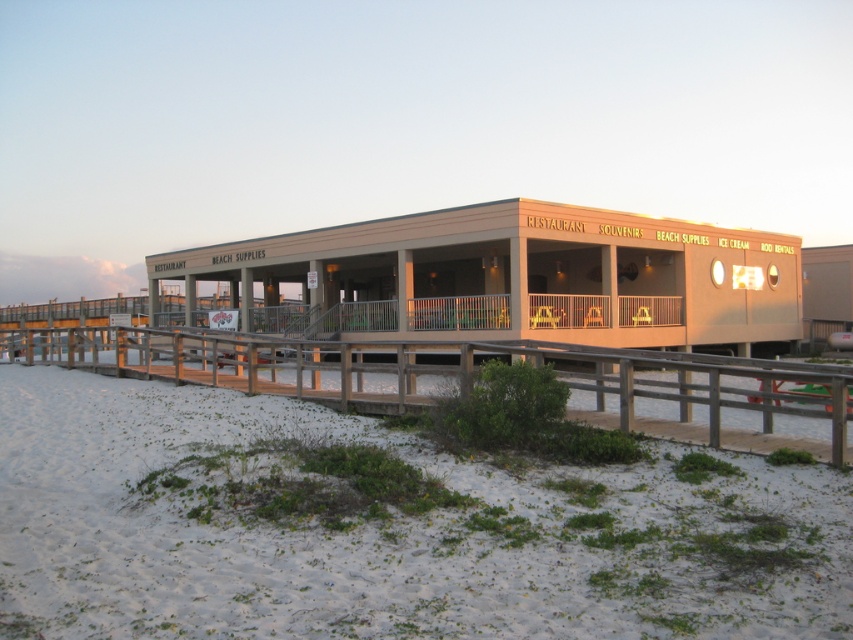
Can you confirm if white sandy beach at lower left is positioned to the left of beige wooden dock at center?

Correct, you'll find white sandy beach at lower left to the left of beige wooden dock at center.

Based on the photo, does white sandy beach at lower left have a larger size compared to beige wooden dock at center?

No.

Does point (453, 550) come farther from viewer compared to point (347, 236)?

No, it is not.

Locate an element on the screen. The height and width of the screenshot is (640, 853). white sandy beach at lower left is located at coordinates (383, 529).

Who is shorter, white sandy beach at lower left or wooden at lower left?

white sandy beach at lower left

Between white sandy beach at lower left and wooden at lower left, which one is positioned lower?

white sandy beach at lower left is below.

Locate an element on the screen. The height and width of the screenshot is (640, 853). white sandy beach at lower left is located at coordinates (383, 529).

Find the location of `white sandy beach at lower left`. white sandy beach at lower left is located at coordinates (383, 529).

What do you see at coordinates (509, 280) in the screenshot? The width and height of the screenshot is (853, 640). I see `beige wooden dock at center` at bounding box center [509, 280].

Is point (206, 257) positioned behind point (303, 371)?

That is True.

Which is in front, point (640, 273) or point (383, 392)?

Point (383, 392) is more forward.

Where is `beige wooden dock at center`? This screenshot has width=853, height=640. beige wooden dock at center is located at coordinates (509, 280).